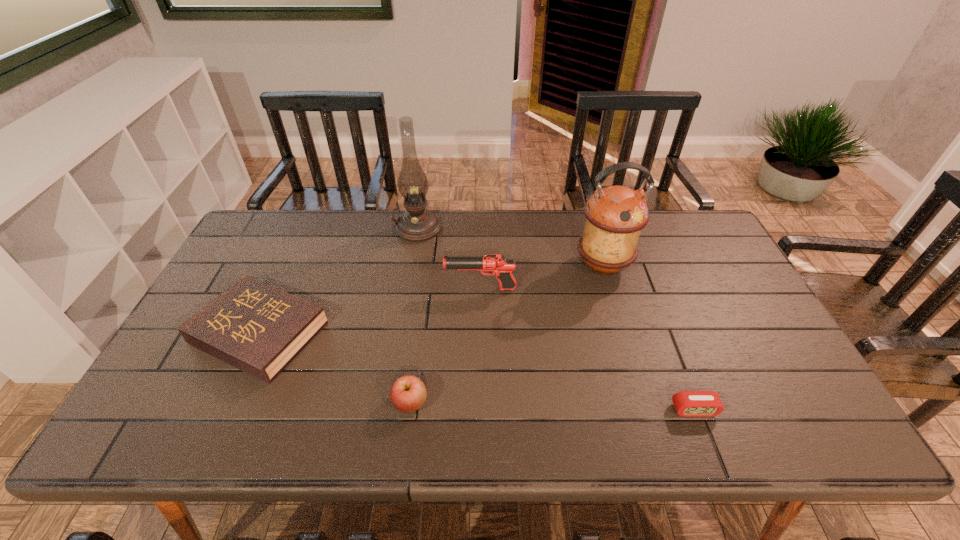
The image size is (960, 540). I want to click on the farther oil lamp, so click(x=417, y=224).

This screenshot has width=960, height=540. What are the coordinates of `the left oil lamp` in the screenshot? It's located at (417, 224).

Identify the location of the right oil lamp. (615, 215).

Where is `the fourth object from left to right`? the fourth object from left to right is located at coordinates (496, 264).

You are a GUI agent. You are given a task and a screenshot of the screen. Output one action in this format:
    pyautogui.click(x=<x>, y=<y>)
    Task: Click on the third tallest object
    The image size is (960, 540).
    Given the screenshot: What is the action you would take?
    pyautogui.click(x=496, y=264)

Locate an element on the screen. This screenshot has width=960, height=540. the third shortest object is located at coordinates (408, 393).

Identify the location of the fifth tallest object. This screenshot has height=540, width=960. (256, 328).

Find the location of a particular element. the leftmost object is located at coordinates (256, 328).

The height and width of the screenshot is (540, 960). I want to click on alarm clock, so click(687, 403).

Find the location of a particular element. vacant space located 0.220m on the left of the left oil lamp is located at coordinates point(329,228).